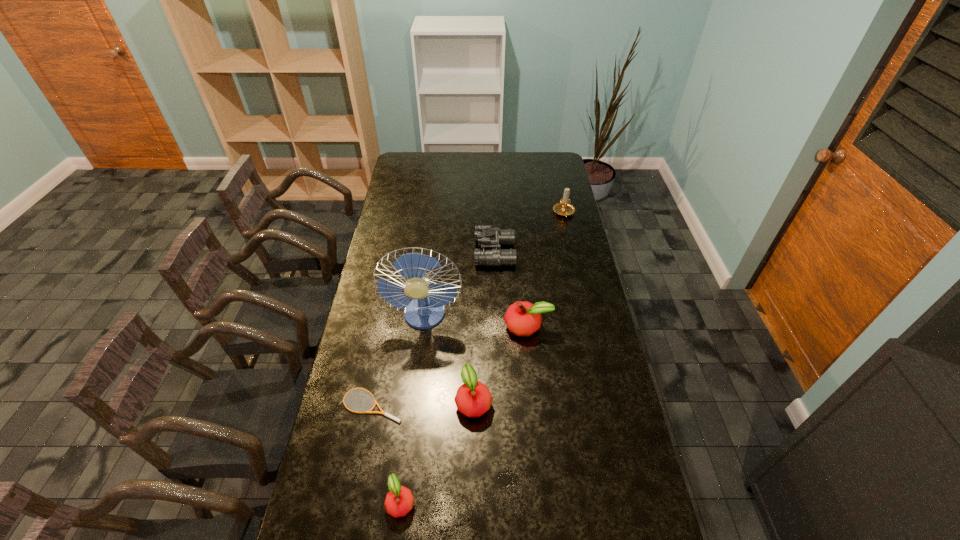
Where is `vacant point located 0.310m on the right of the nearest object`? The width and height of the screenshot is (960, 540). vacant point located 0.310m on the right of the nearest object is located at coordinates (528, 501).

In order to click on vacant space situated on the back of the second nearest apple in this screenshot , I will do `click(474, 342)`.

This screenshot has width=960, height=540. Identify the location of free space located 0.110m on the front of the farthest apple. (531, 367).

You are a GUI agent. You are given a task and a screenshot of the screen. Output one action in this format:
    pyautogui.click(x=<x>, y=<y>)
    Task: Click on the vacant space situated through the lenses of the sixth nearest object
    This screenshot has width=960, height=540.
    Given the screenshot: What is the action you would take?
    pyautogui.click(x=409, y=253)

The height and width of the screenshot is (540, 960). I want to click on free region located through the lenses of the sixth nearest object, so click(x=384, y=253).

Where is `vacant space located through the lenses of the sixth nearest object`? The image size is (960, 540). vacant space located through the lenses of the sixth nearest object is located at coordinates (441, 253).

At what (x,y) coordinates should I click in order to perform the action: click on free region located 0.180m on the left of the candle. Please return your answer as a coordinate pair (x, y). Looking at the image, I should click on (516, 213).

The image size is (960, 540). Identify the location of vacant space located 0.090m at the front of the fan where the blades are visible. (420, 355).

At what (x,y) coordinates should I click in order to perform the action: click on vacant space located on the front of the tennis racket. Please return your answer as a coordinate pair (x, y). Looking at the image, I should click on (363, 453).

Where is `object located in the near edge section of the desktop`? This screenshot has width=960, height=540. object located in the near edge section of the desktop is located at coordinates (399, 500).